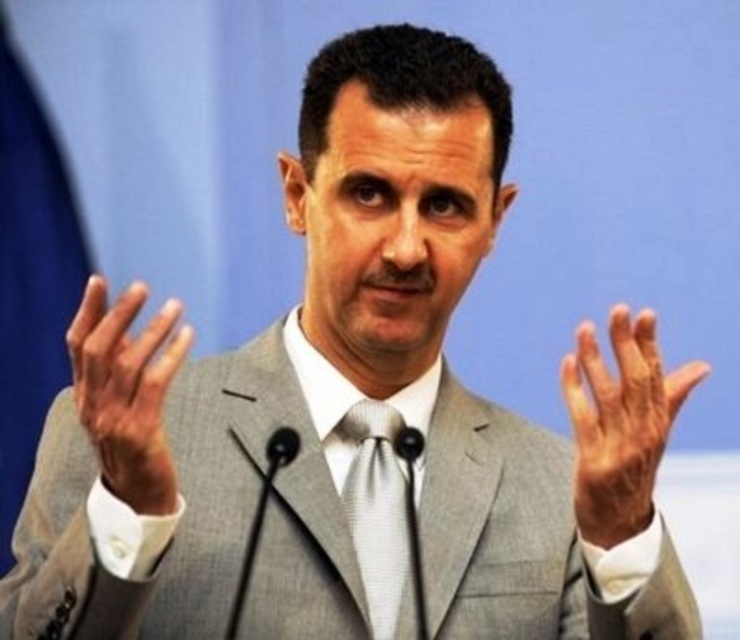
How much distance is there between smooth skin hand at right and smooth skin hand at left?

The distance of smooth skin hand at right from smooth skin hand at left is 27.66 inches.

Looking at this image, between smooth skin hand at right and smooth skin hand at left, which one has more height?

smooth skin hand at right is taller.

Does point (625, 513) come behind point (144, 339)?

Yes, point (625, 513) is farther from viewer.

This screenshot has width=740, height=640. What are the coordinates of `smooth skin hand at right` in the screenshot? It's located at coord(619,422).

Which of these two, smooth skin hand at left or silver textured tie at center, stands shorter?

smooth skin hand at left

Is point (81, 339) in front of point (376, 506)?

Yes.

Describe the element at coordinates (127, 392) in the screenshot. I see `smooth skin hand at left` at that location.

Find the location of `smooth skin hand at left`. smooth skin hand at left is located at coordinates (127, 392).

Based on the photo, who is higher up, smooth skin hand at right or silver textured tie at center?

smooth skin hand at right is higher up.

Who is shorter, smooth skin hand at right or silver textured tie at center?

smooth skin hand at right is shorter.

The height and width of the screenshot is (640, 740). I want to click on smooth skin hand at right, so click(x=619, y=422).

At what (x,y) coordinates should I click in order to perform the action: click on smooth skin hand at right. Please return your answer as a coordinate pair (x, y). Looking at the image, I should click on (619, 422).